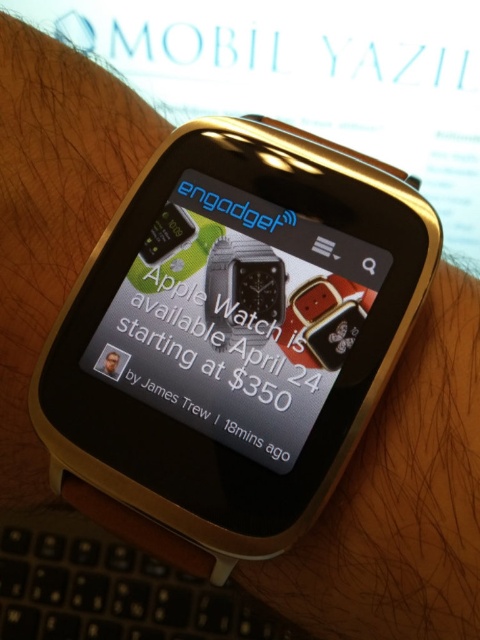
You are a jeweler who needs to place a gold metallic smartwatch at center and a satin black watch at center into a display case. The display case has a shelf that is 5 inches wide. Can both watches fit side by side on the shelf without overlapping?

The gold metallic smartwatch at center is 4.03 inches away from the satin black watch at center. Since the total distance between them is less than the 5 inches shelf width, both watches can fit side by side on the shelf without overlapping.

You are a photographer taking a close look at the gold metallic smartwatch at center and the black plastic keyboard at lower left in the image. Which object is closer to the camera?

The gold metallic smartwatch at center is closer to the camera than the black plastic keyboard at lower left because it is in front of it.

You are looking at a wrist with two smartwatches. The gold metallic smartwatch at center and the satin black watch at center. Which one is more to the left?

The gold metallic smartwatch at center is more to the left because it is positioned on the left side of the satin black watch at center.